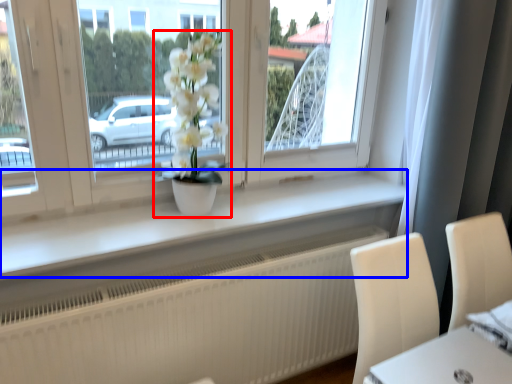
Question: Which of the following is the closest to the observer, houseplant (highlighted by a red box) or window sill (highlighted by a blue box)?

Choices:
 (A) houseplant
 (B) window sill

Answer: (B)